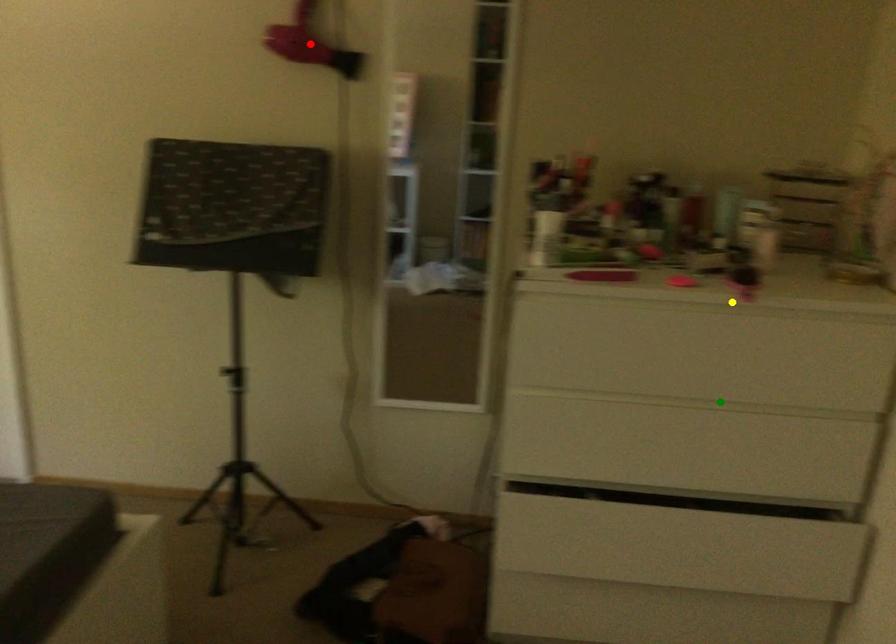
Order these from farthest to nearest:
A) green point
B) red point
C) yellow point

1. red point
2. green point
3. yellow point